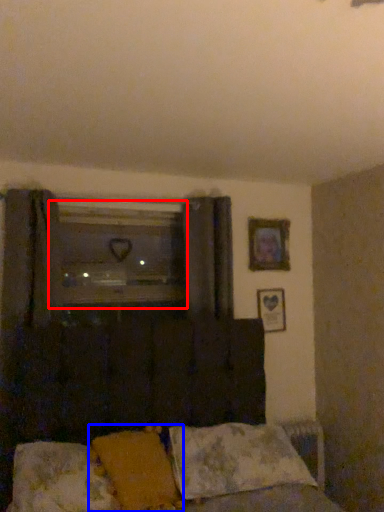
Question: Among these objects, which one is nearest to the camera, window (highlighted by a red box) or pillow (highlighted by a blue box)?

Choices:
 (A) window
 (B) pillow

Answer: (B)